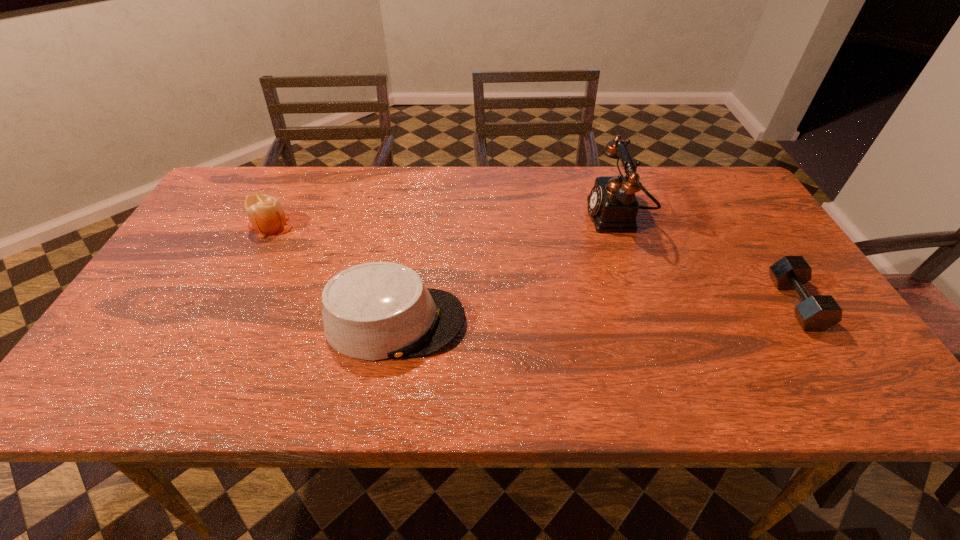
You are a GUI agent. You are given a task and a screenshot of the screen. Output one action in this format:
    pyautogui.click(x=<x>, y=<y>)
    Task: Click on the tallest object
    The height and width of the screenshot is (540, 960).
    Given the screenshot: What is the action you would take?
    pyautogui.click(x=613, y=206)

At what (x,y) coordinates should I click in order to perform the action: click on the third object from left to right. Please return your answer as a coordinate pair (x, y). Looking at the image, I should click on (613, 206).

You are a GUI agent. You are given a task and a screenshot of the screen. Output one action in this format:
    pyautogui.click(x=<x>, y=<y>)
    Task: Click on the leftmost object
    The image size is (960, 540).
    Given the screenshot: What is the action you would take?
    (x=265, y=213)

The height and width of the screenshot is (540, 960). In order to click on hat in this screenshot , I will do `click(374, 311)`.

Locate an element on the screen. This screenshot has width=960, height=540. the rightmost object is located at coordinates (817, 312).

Where is `dumbbell`? The image size is (960, 540). dumbbell is located at coordinates pos(817,312).

You are a GUI agent. You are given a task and a screenshot of the screen. Output one action in this format:
    pyautogui.click(x=<x>, y=<y>)
    Task: Click on the free spot located 0.300m on the front of the second object from right to left at the rotary dial
    This screenshot has height=540, width=960.
    Given the screenshot: What is the action you would take?
    pyautogui.click(x=481, y=217)

Find the location of a particular element. The width and height of the screenshot is (960, 540). vacant area situated on the front of the second object from right to left at the rotary dial is located at coordinates pos(527,217).

I want to click on blank space located on the front of the second object from right to left at the rotary dial, so click(x=506, y=217).

I want to click on free location located on the right of the leftmost object, so click(424, 225).